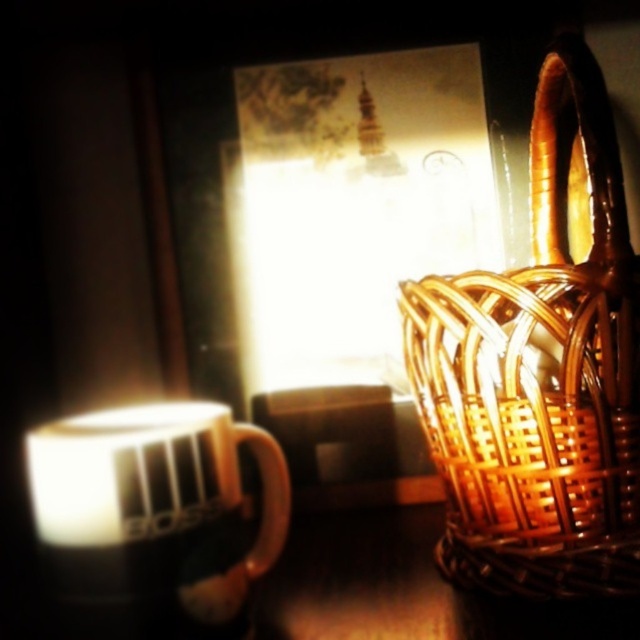
Where is the brown woven basket at right located in the image?

The brown woven basket at right is located at point [540,372] in the image.

You are a delivery robot with a 12 inch wide package. You need to place it between the brown woven basket at right and the white glossy mug at left. Is there enough space between them to fit the package?

The distance between the brown woven basket at right and the white glossy mug at left is 11.13 inches. Since the package is 12 inches wide, it is slightly wider than the available space. Therefore, the package cannot fit between them.

You are arranging items on a shelf and need to place the brown woven basket at right and the white glossy mug at left. Based on the image, which item should be placed higher to maintain the same spatial relationship?

The brown woven basket at right should be placed higher than the white glossy mug at left to maintain the same spatial relationship since it was positioned over it in the image.